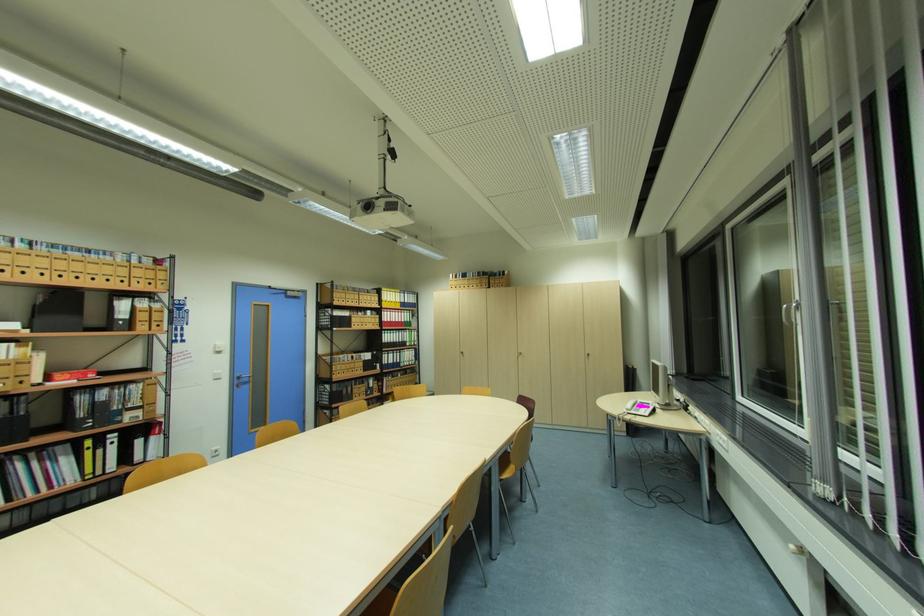
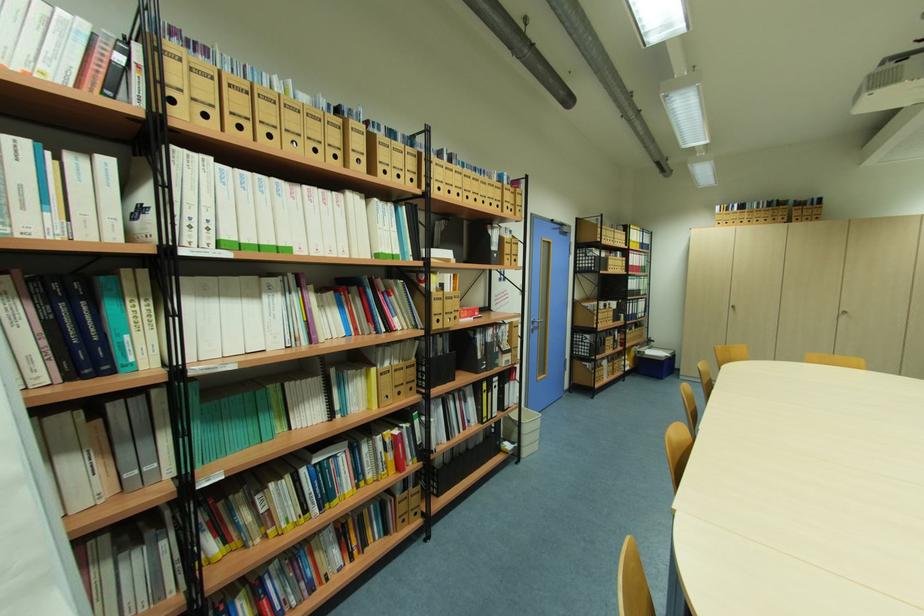
Question: In a continuous first-person perspective shot, in which direction is the camera moving?

Choices:
 (A) Left
 (B) Right
 (C) Forward
 (D) Backward

Answer: (A)